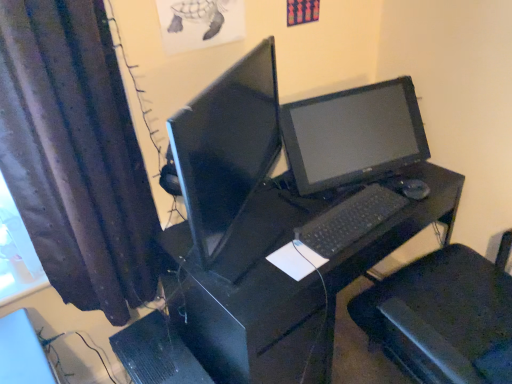
Identify the location of free space that is in between matte black monitor at center and white paper at center. [275, 263].